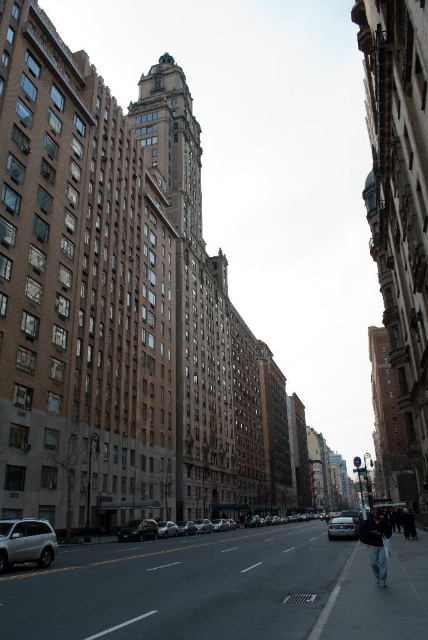
Is dark blue jeans at lower right positioned at the back of shiny silver sedan at center?

No, dark blue jeans at lower right is closer to the viewer.

This screenshot has width=428, height=640. What do you see at coordinates (376, 544) in the screenshot?
I see `dark blue jeans at lower right` at bounding box center [376, 544].

At what (x,y) coordinates should I click in order to perform the action: click on dark blue jeans at lower right. Please return your answer as a coordinate pair (x, y). The width and height of the screenshot is (428, 640). Looking at the image, I should click on (376, 544).

Which is below, silver metallic suv at lower left or shiny silver sedan at center?

shiny silver sedan at center

Does silver metallic suv at lower left have a lesser height compared to shiny silver sedan at center?

In fact, silver metallic suv at lower left may be taller than shiny silver sedan at center.

Between point (5, 525) and point (162, 532), which one is positioned behind?

The point (162, 532) is behind.

Identify the location of silver metallic suv at lower left. (26, 541).

Is dark blue jeans at lower right to the left of silver metallic car at center from the viewer's perspective?

Incorrect, dark blue jeans at lower right is not on the left side of silver metallic car at center.

Who is more distant from viewer, (x=368, y=547) or (x=338, y=538)?

The point (x=338, y=538) is more distant.

Is point (369, 544) positioned after point (347, 536)?

No.

This screenshot has width=428, height=640. Find the location of `dark blue jeans at lower right`. dark blue jeans at lower right is located at coordinates (376, 544).